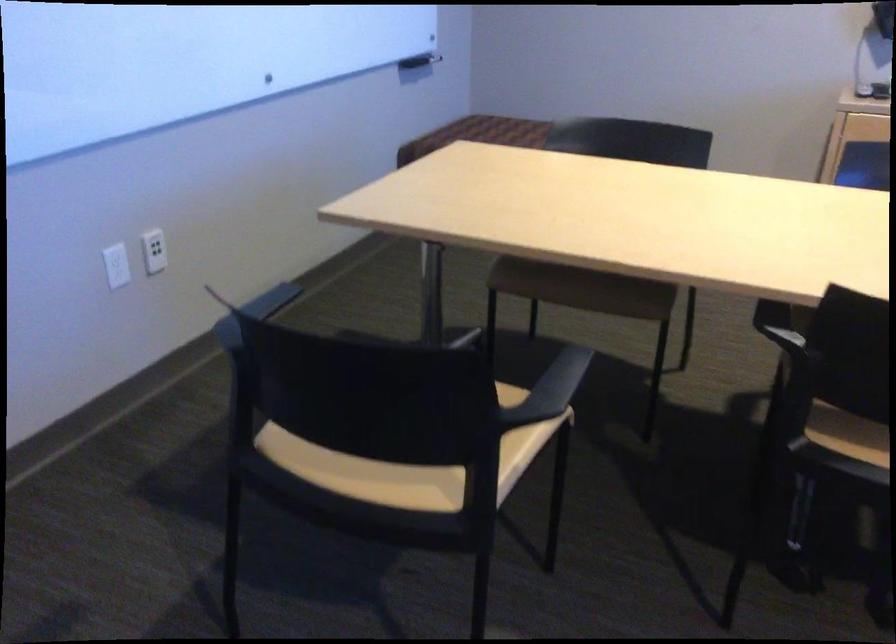
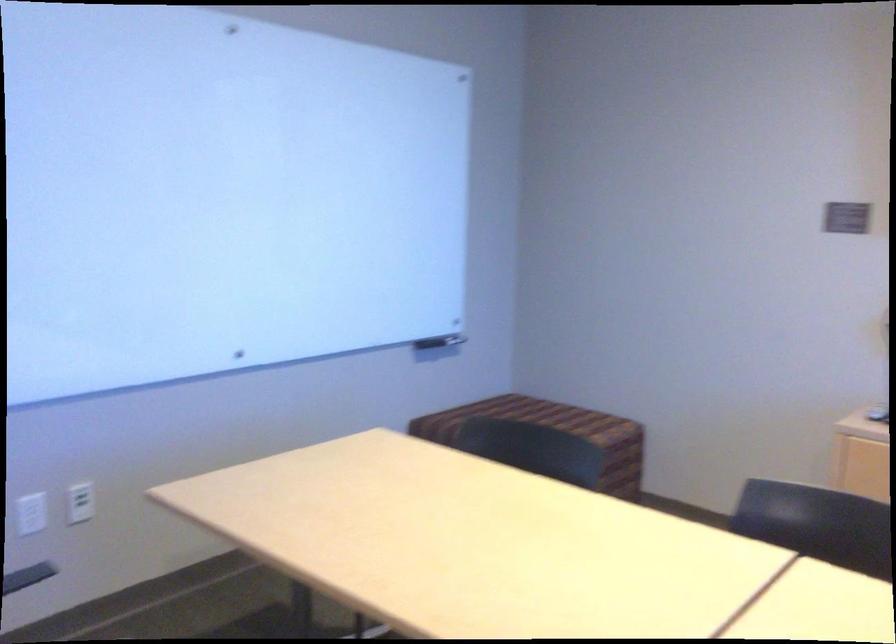
The point at (107, 265) is marked in the first image. Where is the corresponding point in the second image?

(30, 514)